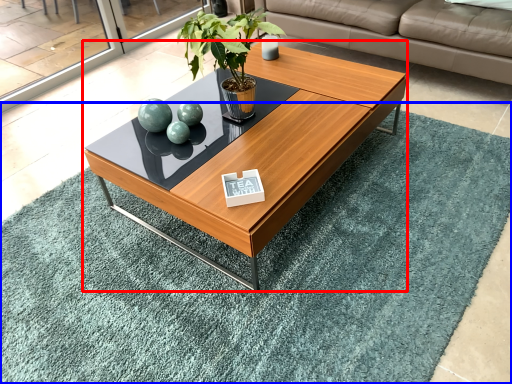
Question: Which object appears closest to the camera in this image, coffee table (highlighted by a red box) or mat (highlighted by a blue box)?

Choices:
 (A) coffee table
 (B) mat

Answer: (B)